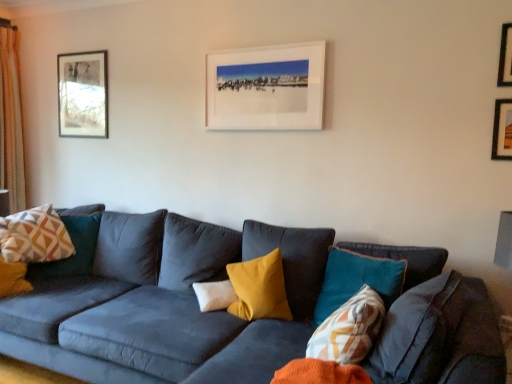
Question: In which direction should I rotate to look at patterned fabric pillow at center, which ranks as the first pillow in front-to-back order?

Choices:
 (A) left
 (B) right

Answer: (B)

Question: Should I look upward or downward to see white matte picture frame at upper center, which is the 3th picture frame from front to back?

Choices:
 (A) up
 (B) down

Answer: (A)

Question: Could you tell me if white matte picture frame at upper center, which is the 3th picture frame from front to back, is facing white soft pillow at center, the 2th pillow positioned from the back?

Choices:
 (A) no
 (B) yes

Answer: (A)

Question: From the image's perspective, would you say white matte picture frame at upper center, positioned as the 2th picture frame in back-to-front order, is positioned over white soft pillow at center, arranged as the second pillow when viewed from the right?

Choices:
 (A) no
 (B) yes

Answer: (B)

Question: Is white matte picture frame at upper center, which ranks as the 2th picture frame in left-to-right order, not within white soft pillow at center, acting as the second pillow starting from the left?

Choices:
 (A) yes
 (B) no

Answer: (A)

Question: Can you confirm if white matte picture frame at upper center, which ranks as the 2th picture frame in left-to-right order, is positioned to the right of white soft pillow at center, arranged as the second pillow when viewed from the right?

Choices:
 (A) yes
 (B) no

Answer: (A)

Question: Are white matte picture frame at upper center, which ranks as the 2th picture frame in left-to-right order, and white soft pillow at center, the 2th pillow positioned from the back, far apart?

Choices:
 (A) yes
 (B) no

Answer: (A)

Question: Does white matte picture frame at upper center, which ranks as the third picture frame in right-to-left order, come in front of white soft pillow at center, arranged as the second pillow when viewed from the right?

Choices:
 (A) yes
 (B) no

Answer: (B)

Question: Considering the relative positions of wooden framed picture at upper left, the fourth picture frame positioned from the right, and light beige textured curtain at left in the image provided, is wooden framed picture at upper left, the fourth picture frame positioned from the right, to the left of light beige textured curtain at left from the viewer's perspective?

Choices:
 (A) yes
 (B) no

Answer: (B)

Question: Is the depth of wooden framed picture at upper left, which appears as the first picture frame when viewed from the left, greater than that of light beige textured curtain at left?

Choices:
 (A) yes
 (B) no

Answer: (B)

Question: Is wooden framed picture at upper left, the fourth picture frame positioned from the right, facing towards light beige textured curtain at left?

Choices:
 (A) yes
 (B) no

Answer: (B)

Question: Is wooden framed picture at upper left, which appears as the first picture frame when viewed from the left, at the right side of light beige textured curtain at left?

Choices:
 (A) no
 (B) yes

Answer: (B)

Question: Considering the relative sizes of wooden framed picture at upper left, which appears as the first picture frame when viewed from the left, and light beige textured curtain at left in the image provided, is wooden framed picture at upper left, which appears as the first picture frame when viewed from the left, wider than light beige textured curtain at left?

Choices:
 (A) no
 (B) yes

Answer: (A)

Question: Is wooden framed picture at upper left, which appears as the first picture frame when viewed from the left, shorter than light beige textured curtain at left?

Choices:
 (A) yes
 (B) no

Answer: (A)

Question: Are light beige textured curtain at left and geometric-patterned fabric pillow at left, the 3th pillow from the right, beside each other?

Choices:
 (A) no
 (B) yes

Answer: (A)